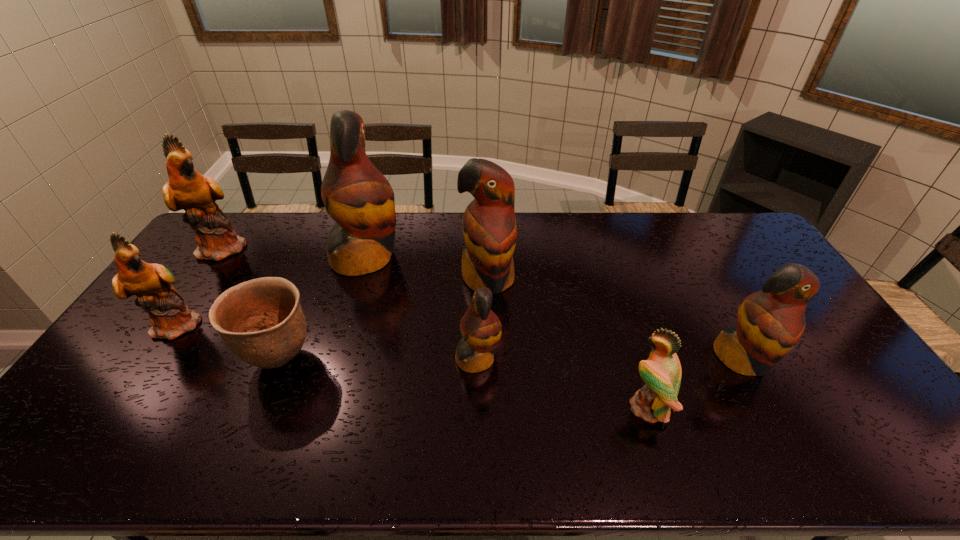
You are a GUI agent. You are given a task and a screenshot of the screen. Output one action in this format:
    pyautogui.click(x=<x>, y=<y>)
    Task: Click on the vacant area between the third smallest red parrot and the rightmost object
    The width and height of the screenshot is (960, 540).
    Given the screenshot: What is the action you would take?
    pyautogui.click(x=614, y=319)

Locate an element on the screen. The image size is (960, 540). blank region between the pottery and the smallest red parrot is located at coordinates (379, 359).

Image resolution: width=960 pixels, height=540 pixels. In order to click on vacant region between the second farthest green parrot and the second biggest red parrot in this screenshot , I will do `click(333, 301)`.

Find the location of a particular element. Image resolution: width=960 pixels, height=540 pixels. object that is the sixth closest to the nearest parrot is located at coordinates (170, 317).

Locate which object is the third closest to the tallest parrot. Please provide its 2D coordinates. Your answer should be formatted as a tuple, i.e. [(x, y)], where the tuple contains the x and y coordinates of a point satisfying the conditions above.

[(187, 189)]

Locate an element on the screen. The width and height of the screenshot is (960, 540). parrot that stands as the sixth closest to the smallest red parrot is located at coordinates (187, 189).

You are a GUI agent. You are given a task and a screenshot of the screen. Output one action in this format:
    pyautogui.click(x=<x>, y=<y>)
    Task: Click on the parrot identified as the fourth closest to the fifth parrot from right to left
    
    Given the screenshot: What is the action you would take?
    pyautogui.click(x=481, y=329)

Select which red parrot is the closest to the biggest green parrot. Please provide its 2D coordinates. Your answer should be formatted as a tuple, i.e. [(x, y)], where the tuple contains the x and y coordinates of a point satisfying the conditions above.

[(357, 196)]

Select which red parrot is the fourth closest to the farthest green parrot. Please provide its 2D coordinates. Your answer should be formatted as a tuple, i.e. [(x, y)], where the tuple contains the x and y coordinates of a point satisfying the conditions above.

[(770, 322)]

Locate which green parrot ranks second in proximity to the shortest object. Please provide its 2D coordinates. Your answer should be formatted as a tuple, i.e. [(x, y)], where the tuple contains the x and y coordinates of a point satisfying the conditions above.

[(187, 189)]